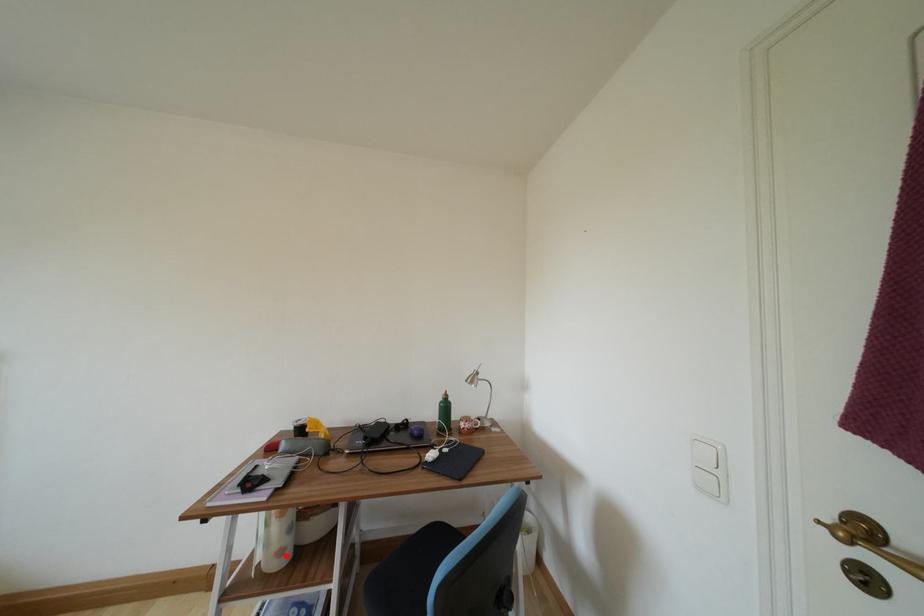
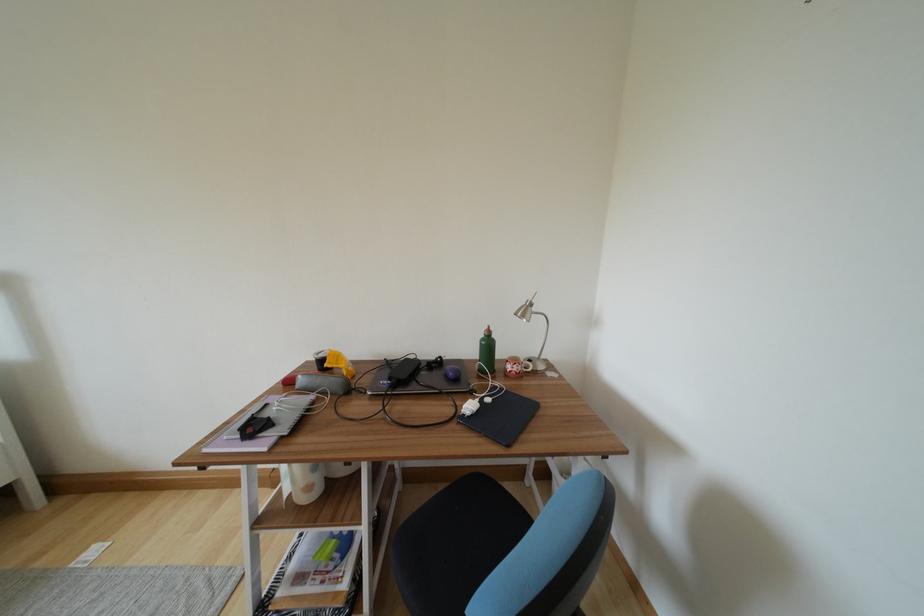
Question: A red point is marked in image1. In image2, is the corresponding 3D point closer to the camera or farther? Reply with the corresponding letter.

Choices:
 (A) The corresponding 3D point is closer.
 (B) The corresponding 3D point is farther.

Answer: (B)